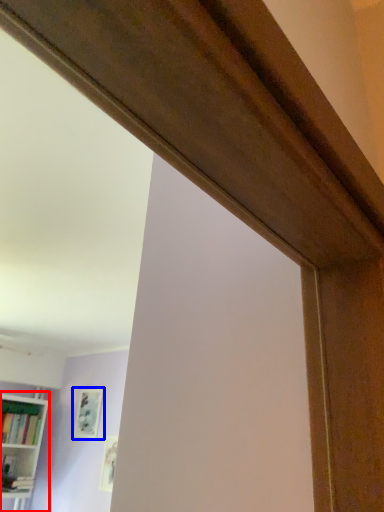
Question: Which object appears closest to the camera in this image, bookcase (highlighted by a red box) or picture frame (highlighted by a blue box)?

Choices:
 (A) bookcase
 (B) picture frame

Answer: (A)